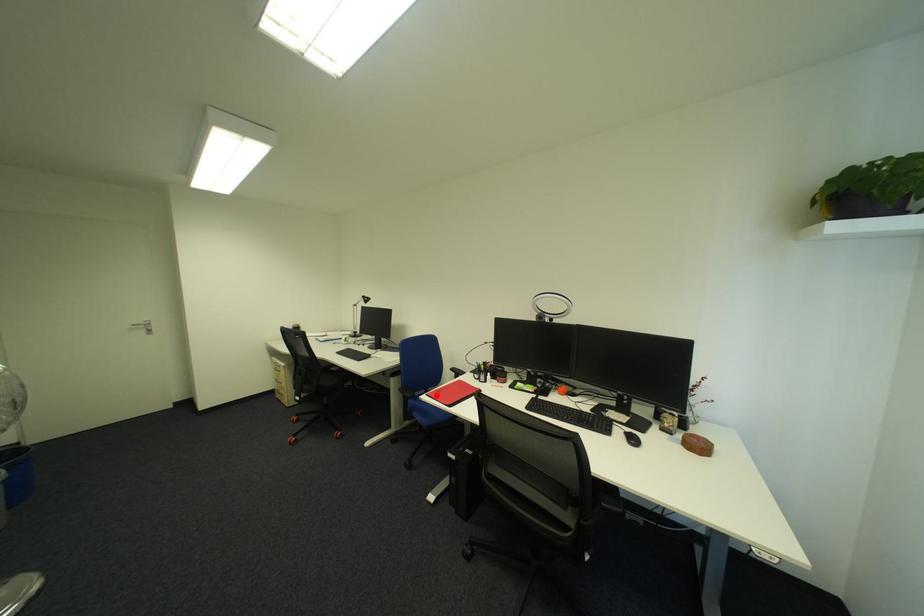
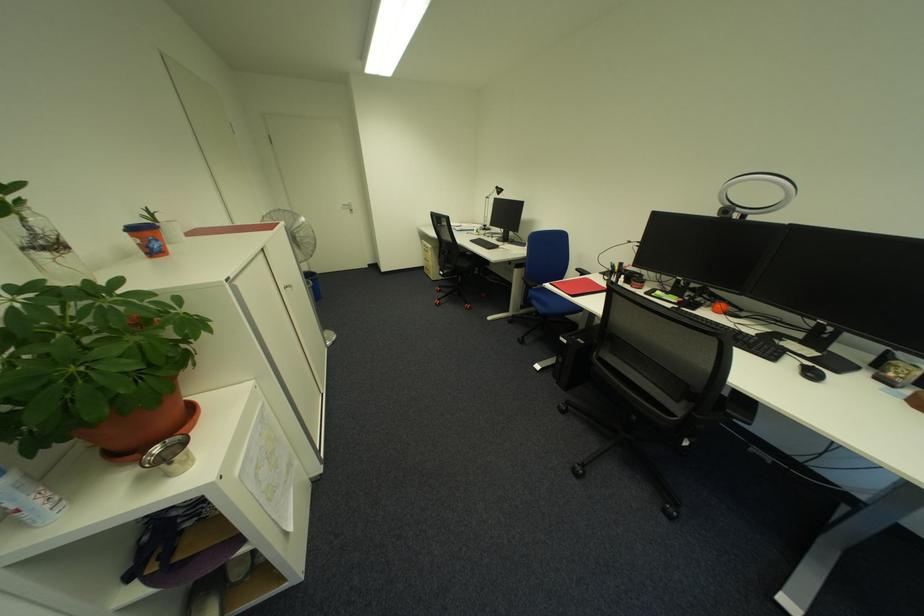
Locate, in the second image, the point that corresponds to the highlighted location in the first image.

(560, 285)